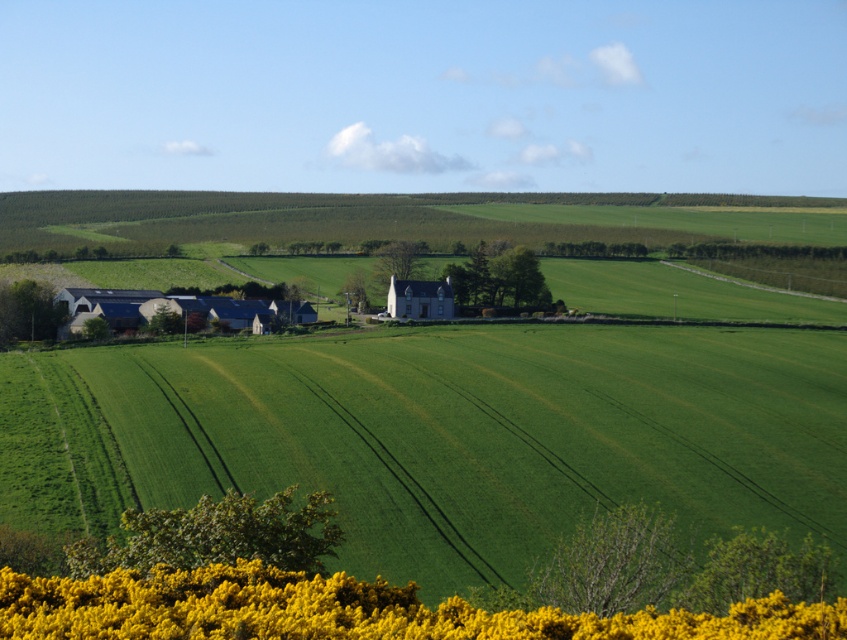
In order to click on green grassy field at center in this screenshot , I will do `click(441, 435)`.

Is green grassy field at center wider than yellow textured flowers at lower center?

Indeed, green grassy field at center has a greater width compared to yellow textured flowers at lower center.

Is point (3, 500) closer to viewer compared to point (554, 624)?

That is False.

The image size is (847, 640). Identify the location of green grassy field at center. (441, 435).